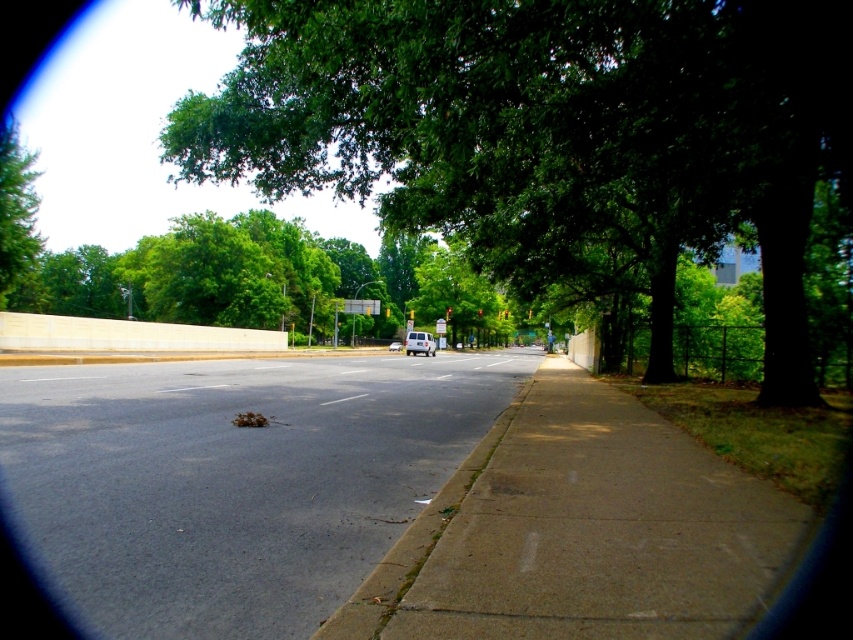
Is dark asphalt road at center below green leafy tree at upper left?

Yes, dark asphalt road at center is below green leafy tree at upper left.

Can you confirm if dark asphalt road at center is positioned to the right of green leafy tree at upper left?

Indeed, dark asphalt road at center is positioned on the right side of green leafy tree at upper left.

Identify the location of dark asphalt road at center. (233, 481).

Does dark asphalt road at center appear on the right side of white matte van at center?

No, dark asphalt road at center is not to the right of white matte van at center.

Between point (346, 525) and point (432, 346), which one is positioned in front?

Point (346, 525) is in front.

You are a GUI agent. You are given a task and a screenshot of the screen. Output one action in this format:
    pyautogui.click(x=<x>, y=<y>)
    Task: Click on the dark asphalt road at center
    
    Given the screenshot: What is the action you would take?
    pyautogui.click(x=233, y=481)

Between green leafy tree at upper left and white matte van at center, which one is positioned lower?

Positioned lower is white matte van at center.

Is green leafy tree at upper left taller than white matte van at center?

Yes.

This screenshot has height=640, width=853. Find the location of `green leafy tree at upper left`. green leafy tree at upper left is located at coordinates (16, 211).